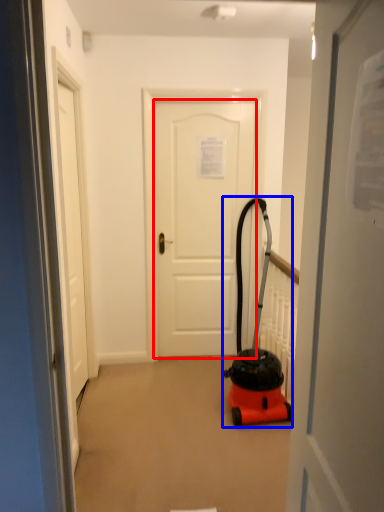
Question: Which object appears closest to the camera in this image, door (highlighted by a red box) or equipment (highlighted by a blue box)?

Choices:
 (A) door
 (B) equipment

Answer: (B)